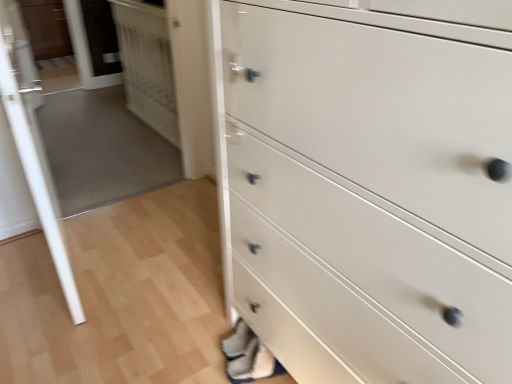
This screenshot has height=384, width=512. What are the coordinates of `vacant space in front of white glossy door at upper left` in the screenshot? It's located at (132, 160).